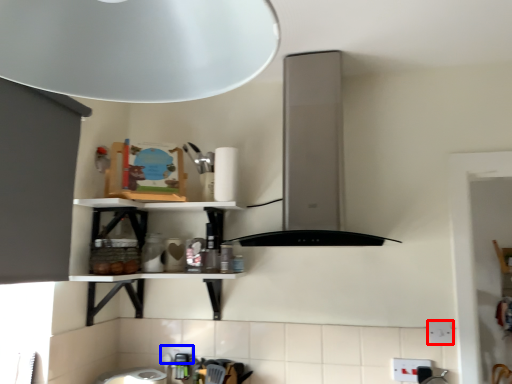
Question: Which object is further to the camera taking this photo, electric outlet (highlighted by a red box) or electric outlet (highlighted by a blue box)?

Choices:
 (A) electric outlet
 (B) electric outlet

Answer: (B)